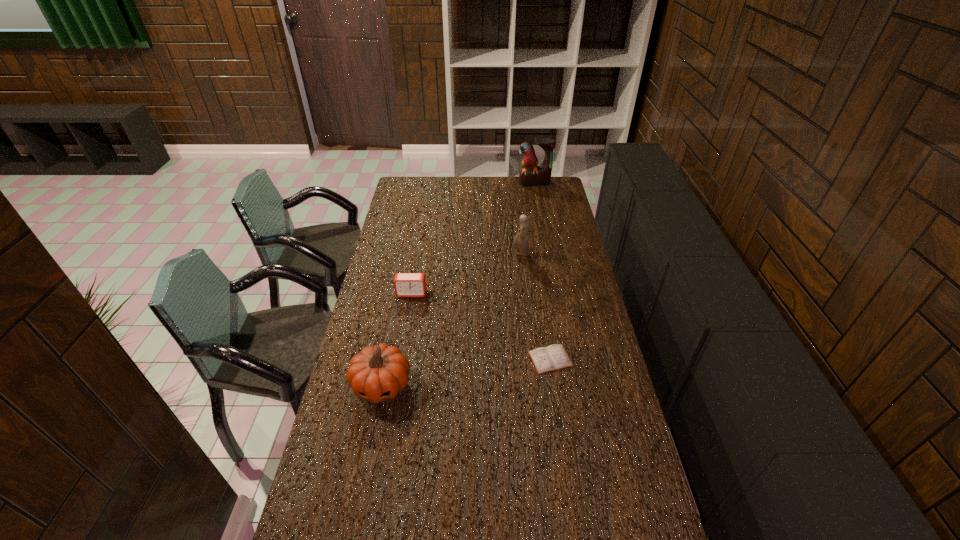
The width and height of the screenshot is (960, 540). What are the coordinates of `the tallest object` in the screenshot? It's located at (531, 175).

The image size is (960, 540). I want to click on parrot, so click(531, 175).

Find the location of a particular element. the fourth nearest object is located at coordinates (521, 242).

Image resolution: width=960 pixels, height=540 pixels. Find the location of `the fourth shortest object`. the fourth shortest object is located at coordinates (521, 242).

I want to click on pumpkin, so click(x=378, y=373).

Find the location of a particular element. The width and height of the screenshot is (960, 540). the second shortest object is located at coordinates (406, 284).

Where is `alarm clock`? alarm clock is located at coordinates (406, 284).

This screenshot has width=960, height=540. I want to click on the shortest object, so click(x=553, y=357).

The image size is (960, 540). Find the location of `free region located 0.150m at the face of the parrot`. free region located 0.150m at the face of the parrot is located at coordinates (538, 201).

Find the location of `vacant space located on the front-facing side of the fourth shortest object`. vacant space located on the front-facing side of the fourth shortest object is located at coordinates (454, 253).